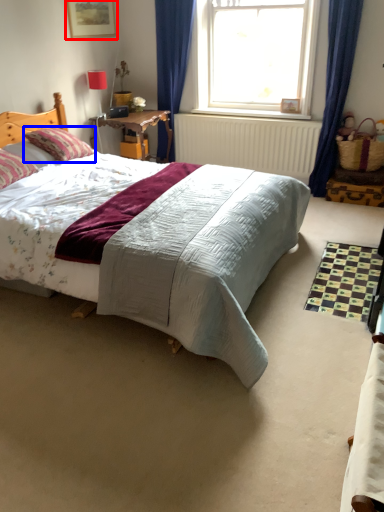
Question: Which object appears farthest to the camera in this image, picture frame (highlighted by a red box) or pillow (highlighted by a blue box)?

Choices:
 (A) picture frame
 (B) pillow

Answer: (A)